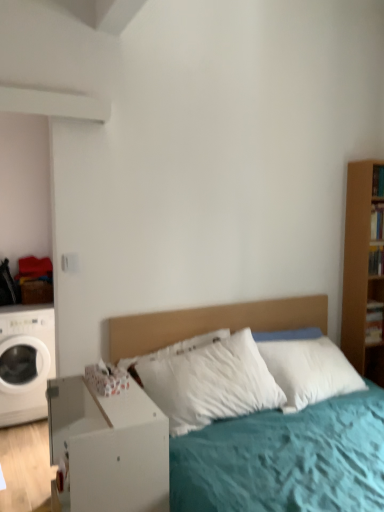
This screenshot has height=512, width=384. Identify the location of white matte washing machine at left. (25, 362).

I want to click on white soft bed at center, so click(x=285, y=460).

Can you confirm if white matte nightstand at lower left is bigger than white soft bed at center?

Incorrect, white matte nightstand at lower left is not larger than white soft bed at center.

Image resolution: width=384 pixels, height=512 pixels. What are the coordinates of `bed that appears above the white matte nightstand at lower left (from a real-world perspective)` in the screenshot? It's located at (285, 460).

Between white matte nightstand at lower left and white soft bed at center, which one has less height?

With less height is white matte nightstand at lower left.

Is white soft bed at center in front of or behind white matte nightstand at lower left in the image?

white soft bed at center is behind white matte nightstand at lower left.

Is white soft bed at center oriented towards white matte nightstand at lower left?

No.

From the image's perspective, is white soft bed at center over white matte nightstand at lower left?

Yes, from the image's perspective, white soft bed at center is on top of white matte nightstand at lower left.

Is white soft bed at center next to white matte nightstand at lower left and touching it?

white soft bed at center is not next to white matte nightstand at lower left, and they're not touching.

Is white matte washing machine at left in front of or behind white soft bed at center in the image?

Visually, white matte washing machine at left is located behind white soft bed at center.

How many degrees apart are the facing directions of white matte washing machine at left and white soft bed at center?

There is a 1.61-degree angle between the facing directions of white matte washing machine at left and white soft bed at center.

Is point (14, 397) in front of point (242, 319)?

No, (14, 397) is behind (242, 319).

Is white matte washing machine at left far from white soft bed at center?

Yes, white matte washing machine at left and white soft bed at center are quite far apart.

Can you confirm if white soft bed at center is positioned to the right of white matte washing machine at left?

Correct, you'll find white soft bed at center to the right of white matte washing machine at left.

Is white soft bed at center looking in the opposite direction of white matte washing machine at left?

Absolutely, white soft bed at center is directed away from white matte washing machine at left.

Is white soft bed at center taller than white matte washing machine at left?

Incorrect, the height of white soft bed at center is not larger of that of white matte washing machine at left.

From a real-world perspective, is white soft bed at center above or below white matte washing machine at left?

white soft bed at center is above white matte washing machine at left.

Is white matte washing machine at left positioned in front of white matte nightstand at lower left?

No, it is not.

This screenshot has width=384, height=512. In order to click on nightstand below the white matte washing machine at left (from a real-world perspective) in this screenshot , I will do `click(110, 446)`.

Is point (4, 371) in front of point (130, 430)?

No, it is not.

From the image's perspective, is white matte washing machine at left located beneath white matte nightstand at lower left?

No, from the image's perspective, white matte washing machine at left is not below white matte nightstand at lower left.

Could you tell me if white matte nightstand at lower left is turned towards white matte washing machine at left?

No.

Is white matte nightstand at lower left next to white matte washing machine at left and touching it?

No.

Between white matte nightstand at lower left and white matte washing machine at left, which one appears on the right side from the viewer's perspective?

white matte nightstand at lower left.

This screenshot has height=512, width=384. Find the location of `nightstand to the right of white matte washing machine at left`. nightstand to the right of white matte washing machine at left is located at coordinates (110, 446).

In order to click on bed lying behind the white matte nightstand at lower left in this screenshot , I will do `click(285, 460)`.

I want to click on nightstand to the left of white soft bed at center, so click(x=110, y=446).

Looking at the image, which one is located closer to white matte washing machine at left, white matte nightstand at lower left or white soft bed at center?

The object closer to white matte washing machine at left is white matte nightstand at lower left.

Based on their spatial positions, is white matte washing machine at left or white matte nightstand at lower left closer to white soft bed at center?

Based on the image, white matte nightstand at lower left appears to be nearer to white soft bed at center.

Based on the photo, looking at the image, which one is located further to white matte nightstand at lower left, white soft bed at center or white matte washing machine at left?

The object further to white matte nightstand at lower left is white matte washing machine at left.

Which object lies further to the anchor point white matte nightstand at lower left, white matte washing machine at left or white soft bed at center?

white matte washing machine at left.

Based on their spatial positions, is white matte nightstand at lower left or white matte washing machine at left closer to white soft bed at center?

white matte nightstand at lower left is positioned closer to the anchor white soft bed at center.

Based on their spatial positions, is white soft bed at center or white matte nightstand at lower left further from white matte washing machine at left?

white soft bed at center.

I want to click on bed between white matte nightstand at lower left and white matte washing machine at left from front to back, so click(285, 460).